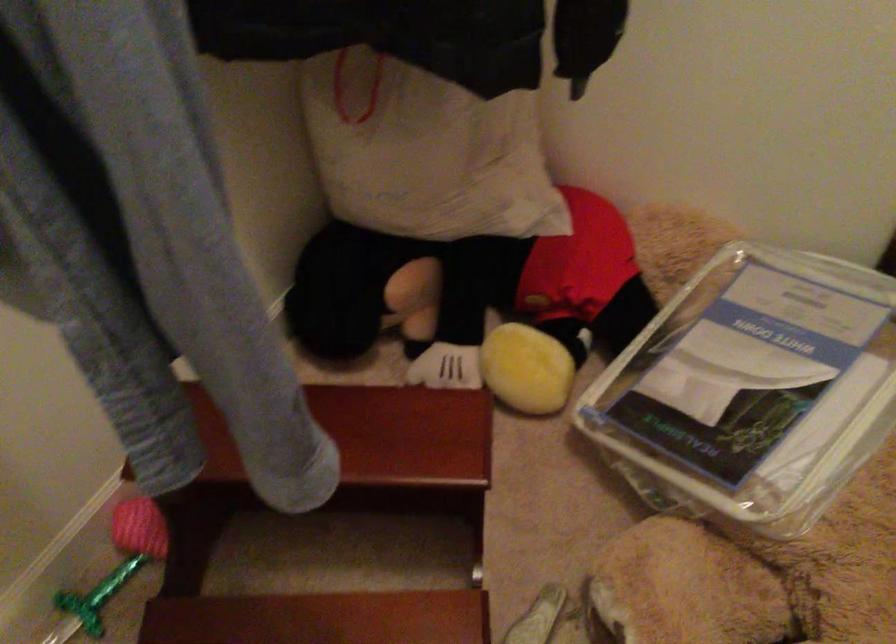
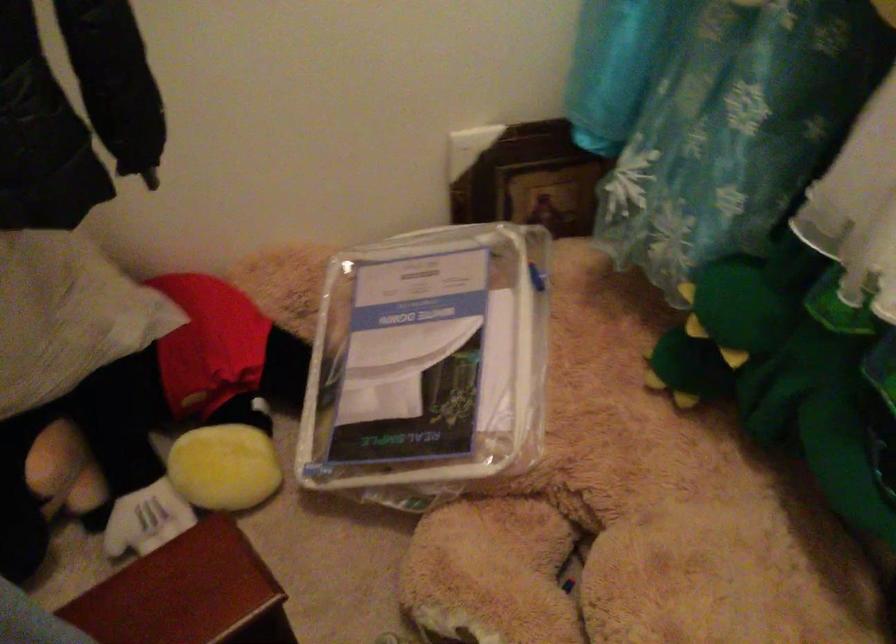
In the second image, find the point that corresponds to pixel 752 384 in the first image.

(427, 365)